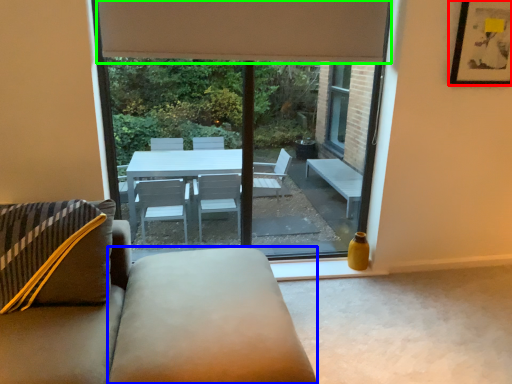
Question: Estimate the real-world distances between objects in this image. Which object is closer to picture frame (highlighted by a red box), flat (highlighted by a blue box) or curtain (highlighted by a green box)?

Choices:
 (A) flat
 (B) curtain

Answer: (B)